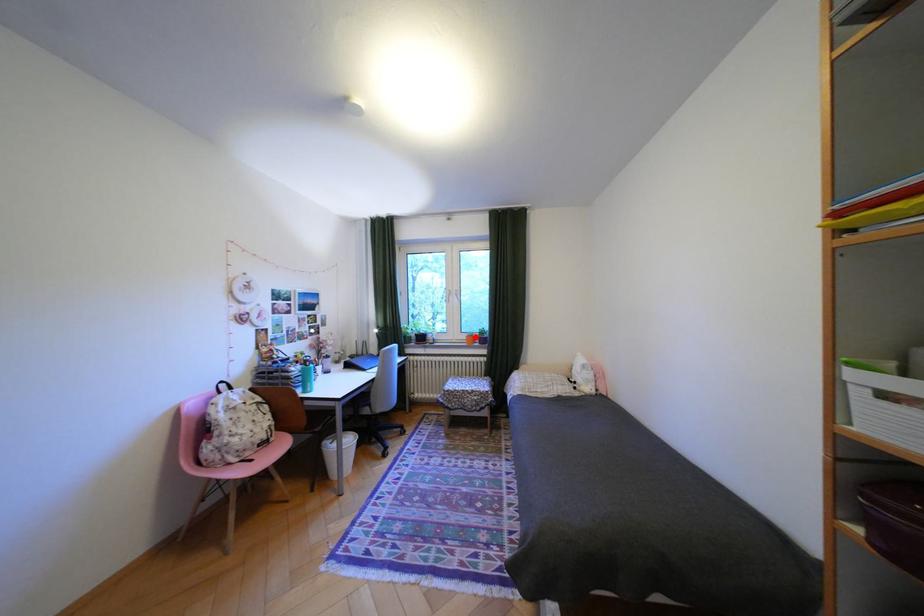
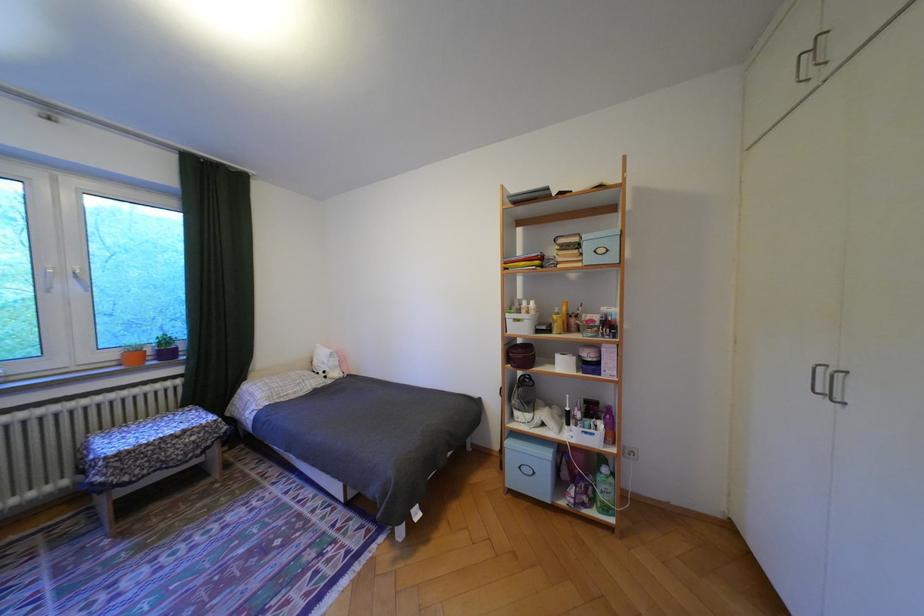
Find the pixel in the second image that matches the highlighted location in the first image.

(124, 355)